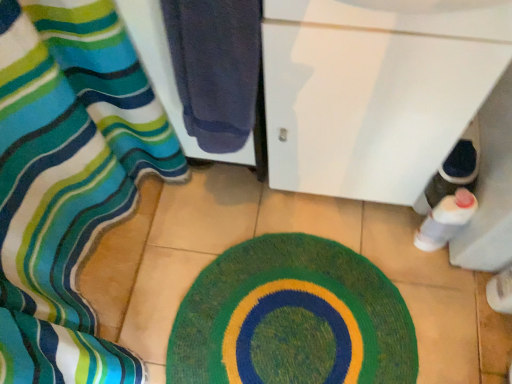
Image resolution: width=512 pixels, height=384 pixels. What do you see at coordinates (216, 67) in the screenshot?
I see `dark blue towel at left` at bounding box center [216, 67].

What do you see at coordinates (292, 318) in the screenshot?
I see `green knitted bath mat at center` at bounding box center [292, 318].

Find the location of `white glossy bottle at lower right`. white glossy bottle at lower right is located at coordinates (446, 220).

Describe the element at coordinates (373, 93) in the screenshot. I see `white glossy cabinet at lower right` at that location.

This screenshot has width=512, height=384. Find the location of `silky striped fabric at left`. silky striped fabric at left is located at coordinates pyautogui.click(x=68, y=179).

Is white glossy cabinet at lower right spatially inside silky striped fabric at left, or outside of it?

white glossy cabinet at lower right is spatially situated outside silky striped fabric at left.

Is white glossy cabinet at lower right oriented towards silky striped fabric at left?

No, white glossy cabinet at lower right does not turn towards silky striped fabric at left.

From the image's perspective, which is below, white glossy cabinet at lower right or silky striped fabric at left?

silky striped fabric at left appears lower in the image.

Could you tell me if white glossy bottle at lower right is facing green knitted bath mat at center?

No, white glossy bottle at lower right is not aimed at green knitted bath mat at center.

Considering the relative sizes of white glossy bottle at lower right and green knitted bath mat at center in the image provided, is white glossy bottle at lower right taller than green knitted bath mat at center?

Yes.

Does white glossy bottle at lower right have a greater width compared to green knitted bath mat at center?

In fact, white glossy bottle at lower right might be narrower than green knitted bath mat at center.

Is point (446, 221) positioned behind point (175, 333)?

No, (446, 221) is in front of (175, 333).

Is white glossy cabinet at lower right aimed at white glossy bottle at lower right?

No, white glossy cabinet at lower right does not turn towards white glossy bottle at lower right.

At what (x,y) coordinates should I click in order to perform the action: click on screen door lying on the left of white glossy bottle at lower right. Please return your answer as a coordinate pair (x, y). Looking at the image, I should click on (373, 93).

Can you confirm if white glossy cabinet at lower right is smaller than white glossy bottle at lower right?

No, white glossy cabinet at lower right is not smaller than white glossy bottle at lower right.

From a real-world perspective, which object stands above the other?

white glossy cabinet at lower right, from a real-world perspective.

Considering the relative sizes of white glossy cabinet at lower right and green knitted bath mat at center in the image provided, is white glossy cabinet at lower right wider than green knitted bath mat at center?

No.

From their relative heights in the image, would you say white glossy cabinet at lower right is taller or shorter than green knitted bath mat at center?

Considering their sizes, white glossy cabinet at lower right has more height than green knitted bath mat at center.

Is white glossy cabinet at lower right aimed at green knitted bath mat at center?

Yes.

Which is closer to the camera, (x=373, y=271) or (x=29, y=178)?

Point (x=373, y=271) is farther from the camera than point (x=29, y=178).

Considering the relative positions of green knitted bath mat at center and silky striped fabric at left in the image provided, is green knitted bath mat at center to the right of silky striped fabric at left from the viewer's perspective?

Yes, green knitted bath mat at center is to the right of silky striped fabric at left.

Between green knitted bath mat at center and silky striped fabric at left, which one has larger width?

Answer: Wider between the two is silky striped fabric at left.

The image size is (512, 384). I want to click on curtain that appears below the green knitted bath mat at center (from a real-world perspective), so click(x=68, y=179).

Is dark blue towel at left positioned behind white glossy cabinet at lower right?

Yes, dark blue towel at left is further from the camera.

The image size is (512, 384). In order to click on towel above the white glossy cabinet at lower right (from a real-world perspective) in this screenshot , I will do `click(216, 67)`.

Is green knitted bath mat at center behind dark blue towel at left?

Yes, the depth of green knitted bath mat at center is greater than that of dark blue towel at left.

Consider the image. From the image's perspective, is green knitted bath mat at center beneath dark blue towel at left?

Correct, green knitted bath mat at center appears lower than dark blue towel at left in the image.

Is green knitted bath mat at center not close to dark blue towel at left?

No, green knitted bath mat at center is not far from dark blue towel at left.

Which is more to the left, green knitted bath mat at center or dark blue towel at left?

From the viewer's perspective, dark blue towel at left appears more on the left side.

Image resolution: width=512 pixels, height=384 pixels. I want to click on screen door on the right of silky striped fabric at left, so click(x=373, y=93).

Identify the location of bath mat below the white glossy bottle at lower right (from a real-world perspective). (292, 318).

Estimate the real-world distances between objects in this image. Which object is closer to green knitted bath mat at center, dark blue towel at left or silky striped fabric at left?

silky striped fabric at left.

Considering their positions, is green knitted bath mat at center positioned further to white glossy bottle at lower right than dark blue towel at left?

dark blue towel at left lies further to white glossy bottle at lower right than the other object.

From the image, which object appears to be nearer to dark blue towel at left, green knitted bath mat at center or silky striped fabric at left?

silky striped fabric at left is closer to dark blue towel at left.

Based on their spatial positions, is green knitted bath mat at center or white glossy cabinet at lower right further from silky striped fabric at left?

white glossy cabinet at lower right.

Looking at the image, which one is located further to white glossy bottle at lower right, dark blue towel at left or white glossy cabinet at lower right?

Among the two, dark blue towel at left is located further to white glossy bottle at lower right.

Which object lies nearer to the anchor point white glossy cabinet at lower right, silky striped fabric at left or dark blue towel at left?

Based on the image, dark blue towel at left appears to be nearer to white glossy cabinet at lower right.

Based on the photo, which object lies further to the anchor point silky striped fabric at left, white glossy cabinet at lower right or green knitted bath mat at center?

Among the two, white glossy cabinet at lower right is located further to silky striped fabric at left.

Looking at the image, which one is located closer to silky striped fabric at left, white glossy bottle at lower right or dark blue towel at left?

Based on the image, dark blue towel at left appears to be nearer to silky striped fabric at left.

Locate an element on the screen. The height and width of the screenshot is (384, 512). bath mat located between silky striped fabric at left and white glossy cabinet at lower right in the left-right direction is located at coordinates (292, 318).

This screenshot has height=384, width=512. In order to click on screen door situated between dark blue towel at left and white glossy bottle at lower right from left to right in this screenshot , I will do `click(373, 93)`.

In order to click on towel between silky striped fabric at left and white glossy cabinet at lower right in the horizontal direction in this screenshot , I will do `click(216, 67)`.

The width and height of the screenshot is (512, 384). What are the coordinates of `towel between silky striped fabric at left and white glossy bottle at lower right` in the screenshot? It's located at (216, 67).